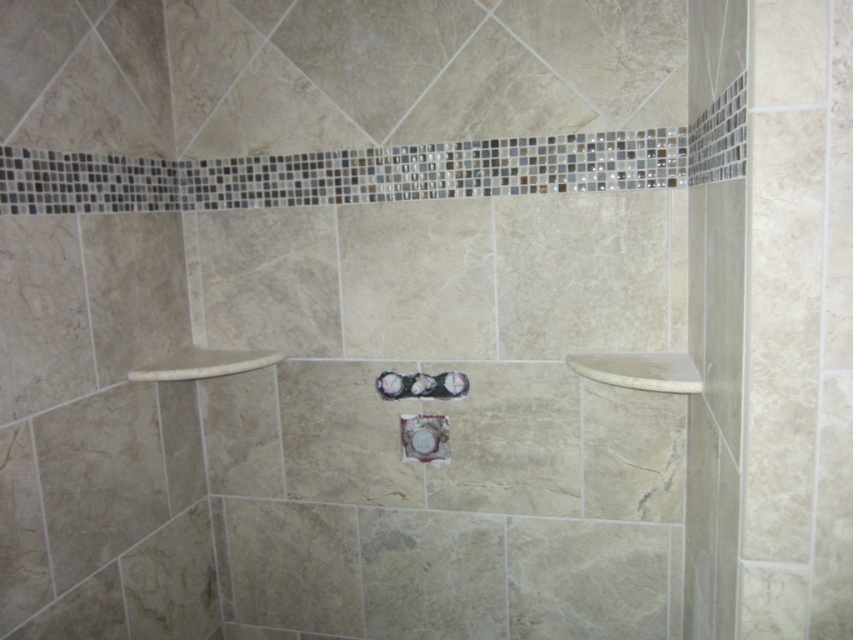
Locate an element on the screen. white marble towel bar at upper right is located at coordinates (639, 369).

Who is shorter, white marble towel bar at upper right or white glossy showerhead at center?

With less height is white marble towel bar at upper right.

Does point (643, 372) lie in front of point (399, 374)?

Yes, it is in front of point (399, 374).

Where is `white marble towel bar at upper right`? Image resolution: width=853 pixels, height=640 pixels. white marble towel bar at upper right is located at coordinates (639, 369).

Does white marble towel bar at upper right have a greater height compared to white marble towel bar at upper left?

No.

Does white marble towel bar at upper right lie in front of white marble towel bar at upper left?

Yes, it is in front of white marble towel bar at upper left.

Locate an element on the screen. white marble towel bar at upper right is located at coordinates (639, 369).

The image size is (853, 640). Find the location of `white marble towel bar at upper left`. white marble towel bar at upper left is located at coordinates pos(202,364).

Does white marble towel bar at upper left have a greater width compared to white glossy showerhead at center?

Yes, white marble towel bar at upper left is wider than white glossy showerhead at center.

Does point (177, 372) come closer to viewer compared to point (410, 376)?

Yes, it is in front of point (410, 376).

Locate an element on the screen. white marble towel bar at upper left is located at coordinates (202, 364).